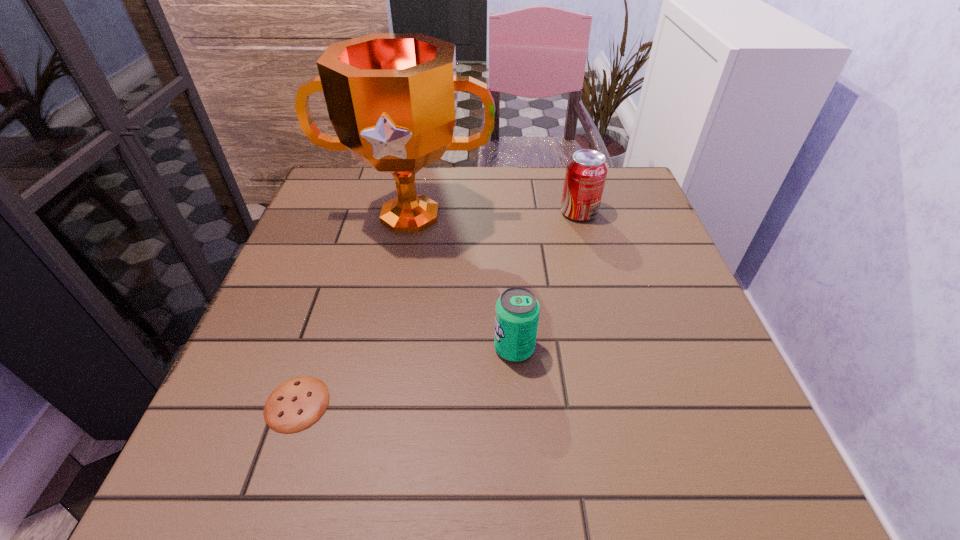
This screenshot has height=540, width=960. I want to click on free space located on the front-facing side of the left pop soda, so click(x=416, y=348).

At what (x,y) coordinates should I click in order to perform the action: click on vacant position located 0.380m on the front-facing side of the left pop soda. Please return your answer as a coordinate pair (x, y). Looking at the image, I should click on (282, 348).

Image resolution: width=960 pixels, height=540 pixels. In order to click on vacant space located on the right of the nearest object in this screenshot , I will do pyautogui.click(x=471, y=404).

You are a GUI agent. You are given a task and a screenshot of the screen. Output one action in this format:
    pyautogui.click(x=<x>, y=<y>)
    Task: Click on the award located at the far edge
    The width and height of the screenshot is (960, 540).
    Given the screenshot: What is the action you would take?
    pyautogui.click(x=391, y=97)

This screenshot has width=960, height=540. In order to click on soda can positioned at the far edge in this screenshot , I will do `click(586, 171)`.

Find the location of a particular element. Image resolution: width=960 pixels, height=540 pixels. object that is at the near edge is located at coordinates (295, 405).

Locate an element on the screen. award present at the left edge is located at coordinates (391, 97).

At what (x,y) coordinates should I click in order to perform the action: click on cookie present at the left edge. Please return your answer as a coordinate pair (x, y). The image size is (960, 540). Looking at the image, I should click on (295, 405).

This screenshot has width=960, height=540. Identify the location of object that is at the right edge. (586, 171).

Where is `object that is at the far left corner`? object that is at the far left corner is located at coordinates (391, 97).